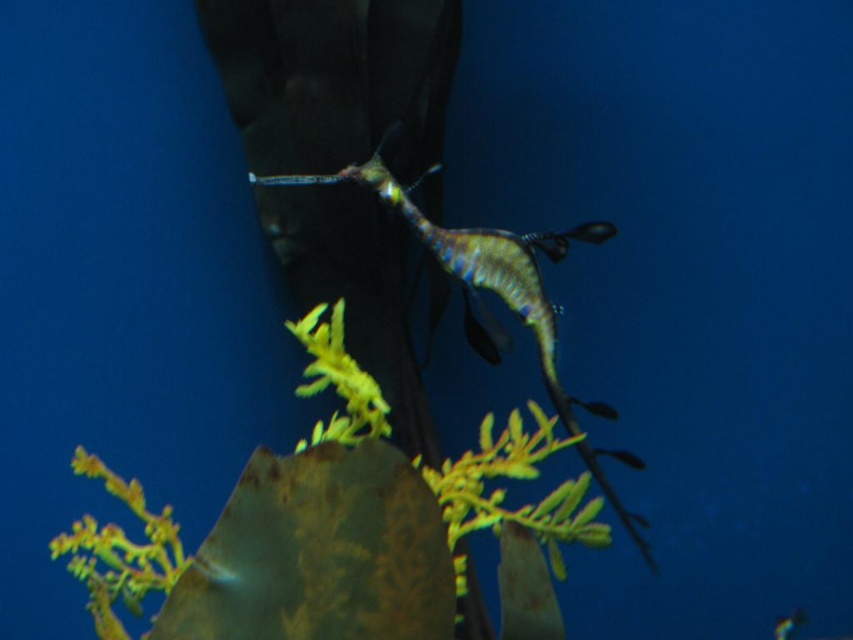
Consider the image. You are a marine biologist observing underwater life. You notice a green iridescent seahorse at center and a shiny silver fish at center. Which creature has a larger width according to their positions?

The green iridescent seahorse at center might be wider than the shiny silver fish at center.

Looking at this image, you are a marine biologist observing an underwater scene. You notice a point at coordinates (341, 531). Based on the scene description, what object is located at that point?

The point at coordinates (341, 531) corresponds to the green leafy plant at center.

You are a marine biologist observing an underwater scene. You notice a point at coordinates (474, 259). Based on the scene description, which object in the image does this point belong to?

The point at coordinates (474, 259) is on the green iridescent seahorse at center.